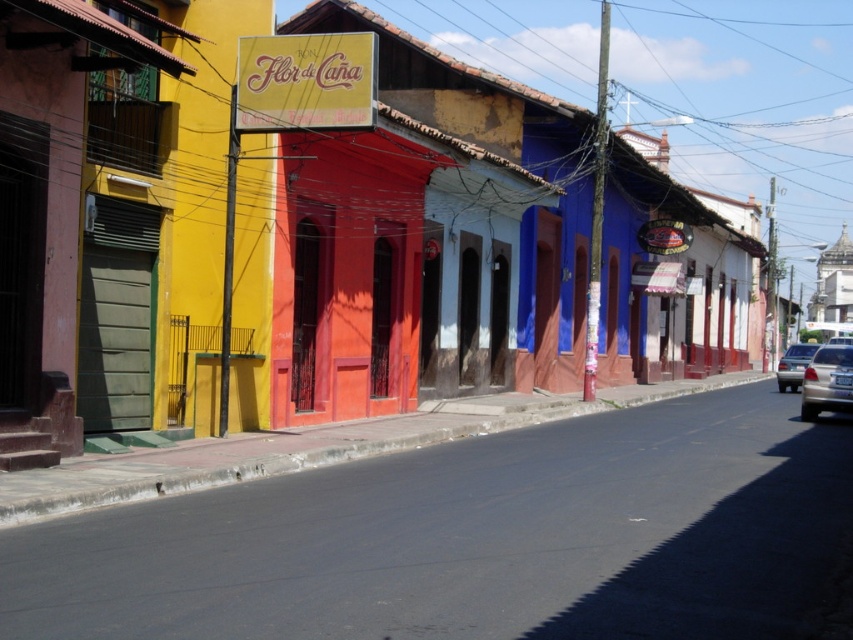
You are standing on the sidewalk in the middle of the street scene. You see a point marked at coordinate (827,381). What object does this point correspond to?

The point corresponds to the silver metallic car at lower right.

You are a pedestrian standing on the sidewalk near the buildings. You want to cross the street to the other side. There are two cars parked at the lower right. Which car should you avoid stepping in front of if you want to cross safely? Please choose between the silver metallic car at lower right and the satin silver sedan at lower right.

You should avoid stepping in front of the silver metallic car at lower right because it is parked to the right of the satin silver sedan at lower right, meaning it is closer to the sidewalk where you are standing. Crossing in front of it might put you in the path of moving traffic.